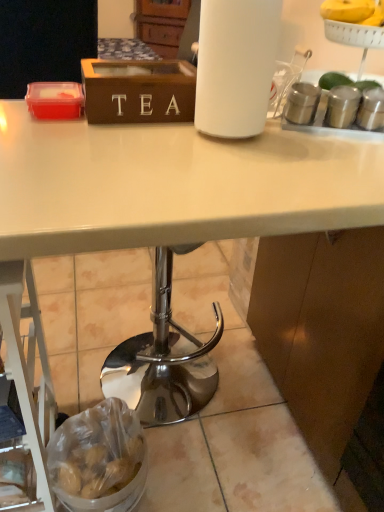
Locate an element on the screen. The image size is (384, 512). free space behind translucent plastic bag of potatoes at lower left is located at coordinates (148, 414).